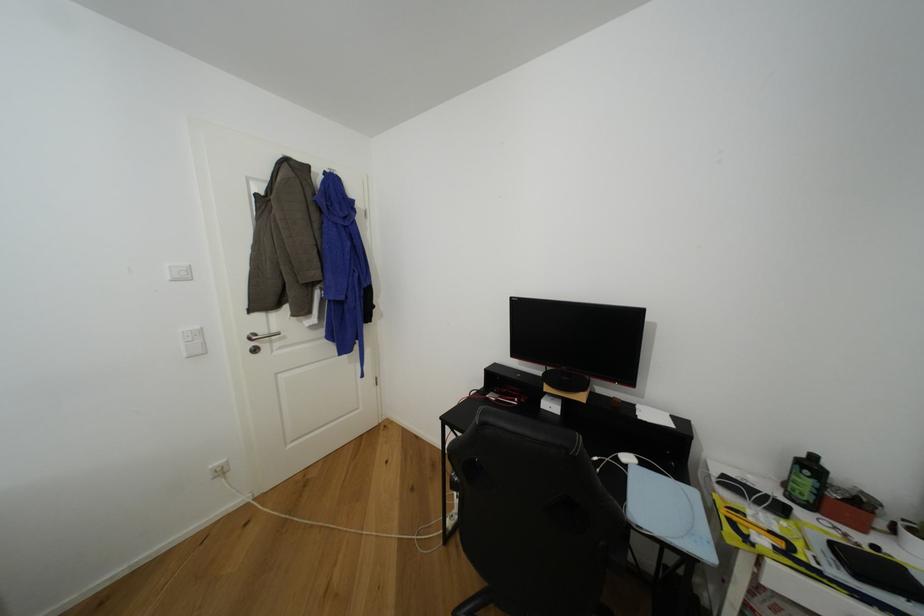
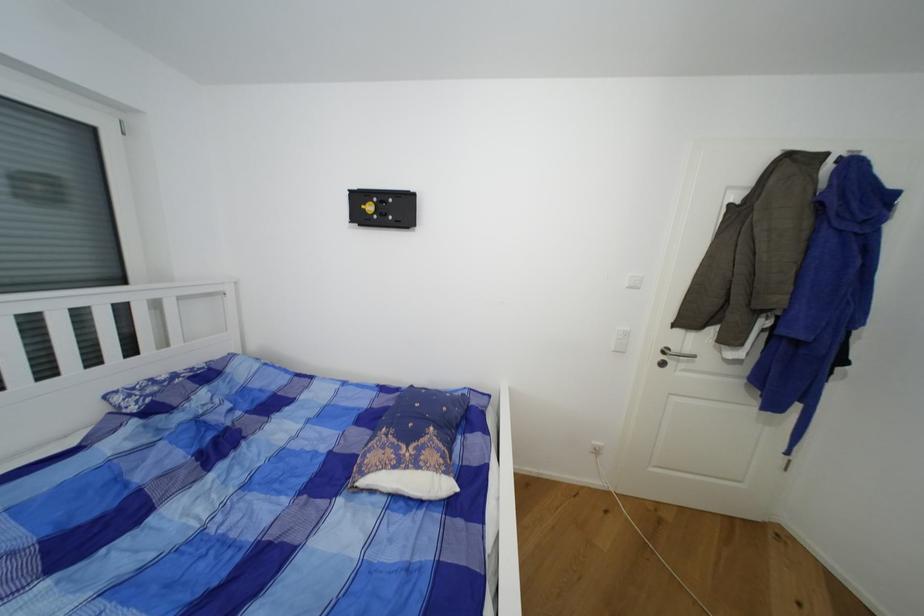
Question: Based on the continuous images, in which direction is the camera rotating? Reply with the corresponding letter.

Choices:
 (A) Left
 (B) Right
 (C) Up
 (D) Down

Answer: (A)